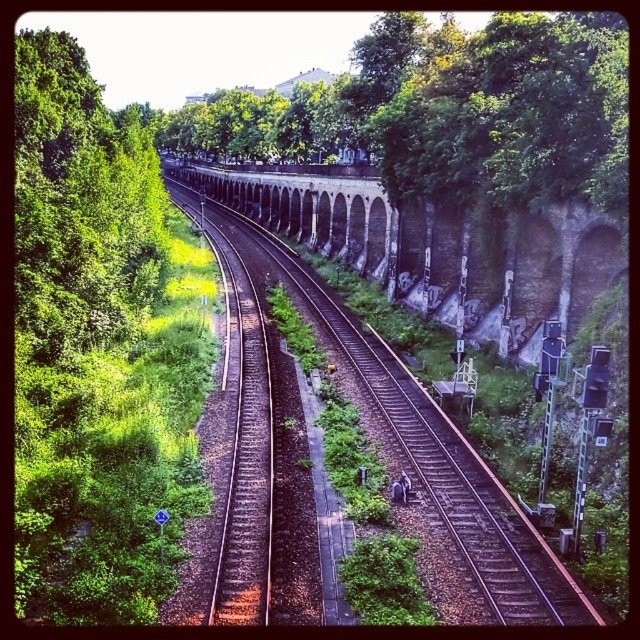
You are a train engineer approaching the railway tracks. You notice two points marked on your map. The first point is at coordinate point (129, 557) and the second is at point (259, 481). Which point is closer to your current position as you move along the tracks?

Point (129, 557) is in front of point (259, 481), so the first point is closer to your current position as you move along the tracks.

You are a railway inspector checking the tracks. You notice the green leafy tree at left and the brown gravel train track at center. Which object is closer to the left edge of the railway?

The green leafy tree at left is closer to the left edge of the railway since it is positioned on the left side of the brown gravel train track at center.